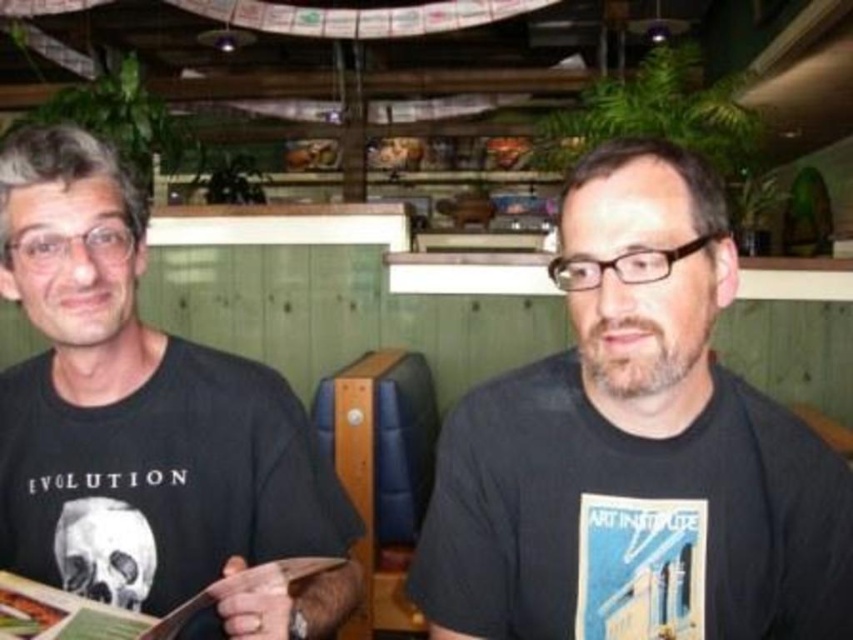
Is black matte t-shirt at center taller than black matte t-shirt at left?

Incorrect, black matte t-shirt at center's height is not larger of black matte t-shirt at left's.

This screenshot has height=640, width=853. Describe the element at coordinates (635, 449) in the screenshot. I see `black matte t-shirt at center` at that location.

Is point (737, 541) positioned behind point (163, 348)?

That is False.

You are a GUI agent. You are given a task and a screenshot of the screen. Output one action in this format:
    pyautogui.click(x=<x>, y=<y>)
    Task: Click on the black matte t-shirt at center
    
    Given the screenshot: What is the action you would take?
    pyautogui.click(x=635, y=449)